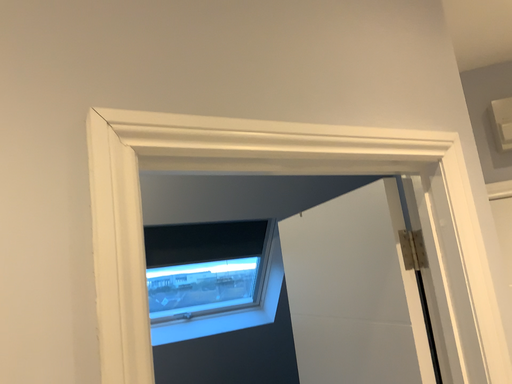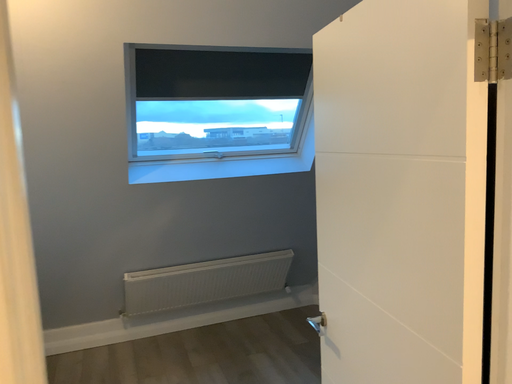
Question: How did the camera likely rotate when shooting the video?

Choices:
 (A) rotated right
 (B) rotated left

Answer: (B)